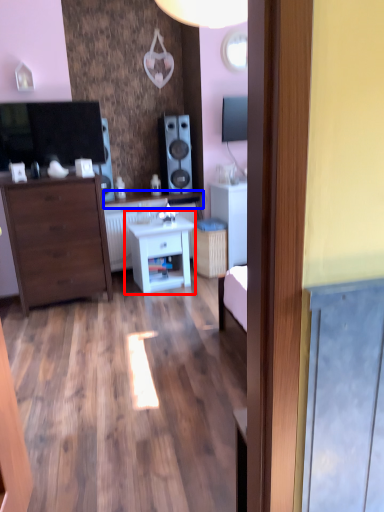
Question: Which of the following is the closest to the observer, nightstand (highlighted by a red box) or counter top (highlighted by a blue box)?

Choices:
 (A) nightstand
 (B) counter top

Answer: (A)